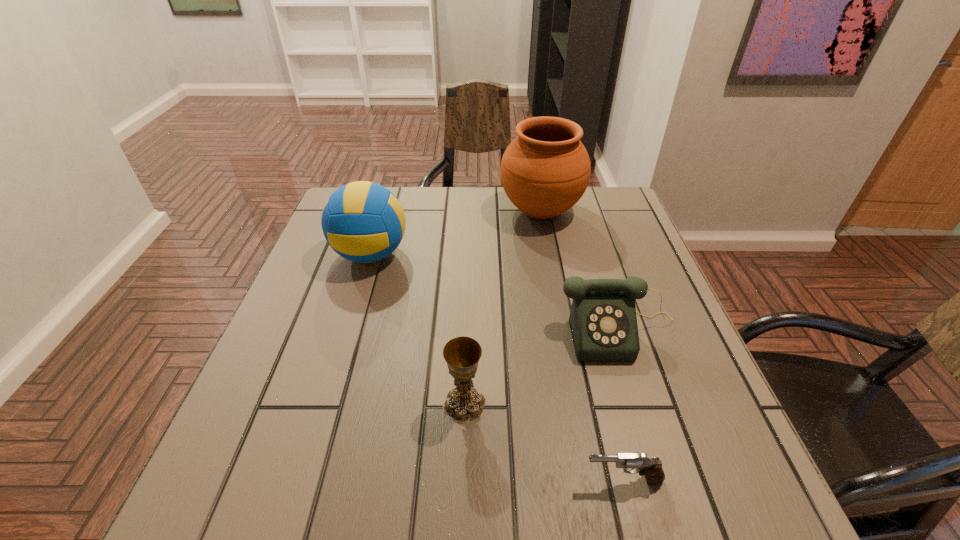
The image size is (960, 540). In order to click on vacant space in between the nearest object and the second shortest object in this screenshot , I will do `click(620, 405)`.

Find the location of a particular element. free point between the telephone and the second nearest object is located at coordinates (541, 367).

The height and width of the screenshot is (540, 960). Find the location of `vacant region between the chalice and the shortest object`. vacant region between the chalice and the shortest object is located at coordinates (543, 442).

Locate an element on the screen. Image resolution: width=960 pixels, height=540 pixels. free area in between the leftmost object and the second shortest object is located at coordinates (494, 293).

Image resolution: width=960 pixels, height=540 pixels. I want to click on vacant region between the second object from left to right and the second tallest object, so click(x=418, y=329).

The width and height of the screenshot is (960, 540). Find the location of `vacant area that lies between the pottery and the fourth farthest object`. vacant area that lies between the pottery and the fourth farthest object is located at coordinates coord(503,308).

Locate an element on the screen. This screenshot has width=960, height=540. vacant space that's between the volleyball and the third farthest object is located at coordinates click(494, 293).

Identify the location of vacant space that's between the leftmost object and the third nearest object. Image resolution: width=960 pixels, height=540 pixels. (494, 293).

The image size is (960, 540). I want to click on free space between the pistol and the fourth tallest object, so click(620, 405).

Where is `the fourth closest object to the nearest object`? the fourth closest object to the nearest object is located at coordinates (545, 170).